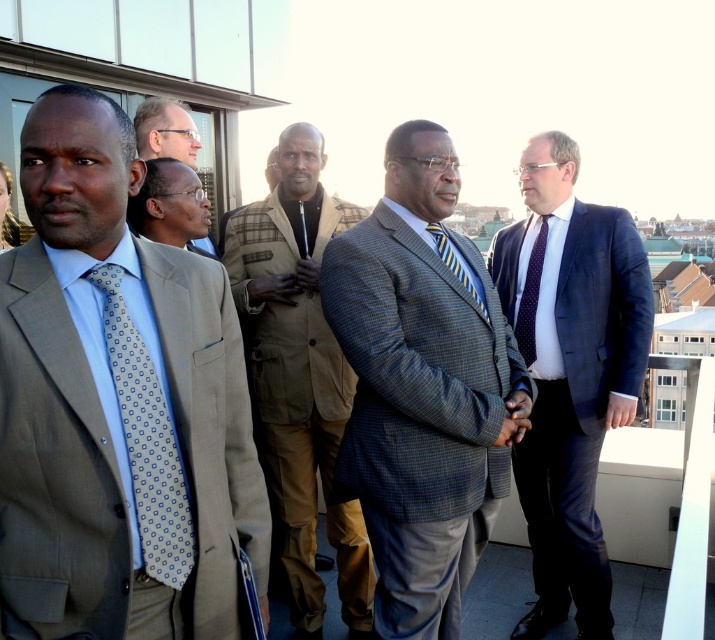
How much distance is there between matte beige suit at left and light brown suit at center?

A distance of 53.71 feet exists between matte beige suit at left and light brown suit at center.

Which is in front, point (143, 548) or point (167, 225)?

Point (143, 548)

The height and width of the screenshot is (640, 715). In order to click on matte beige suit at left in this screenshot , I will do `click(117, 404)`.

Does light brown suit at center have a lesser width compared to striped silk tie at center?

Correct, light brown suit at center's width is less than striped silk tie at center's.

Is point (164, 236) behind point (445, 256)?

Yes, it is.

Locate an element on the screen. The height and width of the screenshot is (640, 715). light brown suit at center is located at coordinates (169, 205).

Can you confirm if blue textured suit at right is shorter than light brown suit at center?

In fact, blue textured suit at right may be taller than light brown suit at center.

Can you confirm if blue textured suit at right is taller than light brown suit at center?

Yes.

Which is behind, point (528, 493) or point (172, 220)?

The point (172, 220) is behind.

Where is `blue textured suit at right`? Image resolution: width=715 pixels, height=640 pixels. blue textured suit at right is located at coordinates (571, 372).